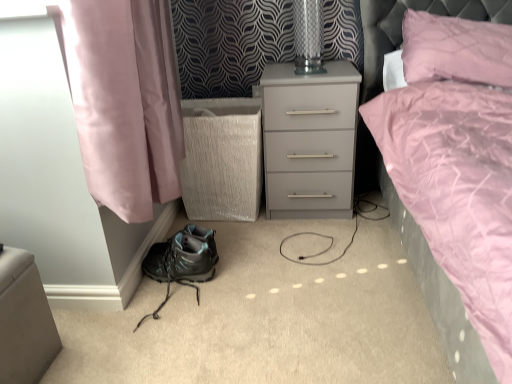
Question: Is the surface of matte gray nightstand at center in direct contact with matte black hiking boot at lower left?

Choices:
 (A) no
 (B) yes

Answer: (A)

Question: Could you tell me if matte gray nightstand at center is turned towards matte black hiking boot at lower left?

Choices:
 (A) yes
 (B) no

Answer: (B)

Question: Is matte gray nightstand at center outside of matte black hiking boot at lower left?

Choices:
 (A) yes
 (B) no

Answer: (A)

Question: Is matte gray nightstand at center at the left side of matte black hiking boot at lower left?

Choices:
 (A) yes
 (B) no

Answer: (B)

Question: Is matte gray nightstand at center at the right side of matte black hiking boot at lower left?

Choices:
 (A) no
 (B) yes

Answer: (B)

Question: Based on their positions, is matte black hiking boot at lower left located to the left or right of pink quilted pillow at upper right?

Choices:
 (A) right
 (B) left

Answer: (B)

Question: Considering the positions of matte black hiking boot at lower left and pink quilted pillow at upper right in the image, is matte black hiking boot at lower left wider or thinner than pink quilted pillow at upper right?

Choices:
 (A) thin
 (B) wide

Answer: (A)

Question: From their relative heights in the image, would you say matte black hiking boot at lower left is taller or shorter than pink quilted pillow at upper right?

Choices:
 (A) short
 (B) tall

Answer: (A)

Question: From a real-world perspective, is matte black hiking boot at lower left above or below pink quilted pillow at upper right?

Choices:
 (A) below
 (B) above

Answer: (A)

Question: Relative to pink quilted pillow at upper right, is transparent glass table lamp at upper center in front or behind?

Choices:
 (A) behind
 (B) front

Answer: (A)

Question: Looking at the image, does transparent glass table lamp at upper center seem bigger or smaller compared to pink quilted pillow at upper right?

Choices:
 (A) small
 (B) big

Answer: (A)

Question: Would you say transparent glass table lamp at upper center is to the left or to the right of pink quilted pillow at upper right in the picture?

Choices:
 (A) right
 (B) left

Answer: (B)

Question: From the image's perspective, is transparent glass table lamp at upper center positioned above or below pink quilted pillow at upper right?

Choices:
 (A) below
 (B) above

Answer: (B)

Question: Relative to matte black hiking boot at lower left, is transparent glass table lamp at upper center in front or behind?

Choices:
 (A) behind
 (B) front

Answer: (A)

Question: Does point (304, 64) appear closer or farther from the camera than point (202, 253)?

Choices:
 (A) closer
 (B) farther

Answer: (B)